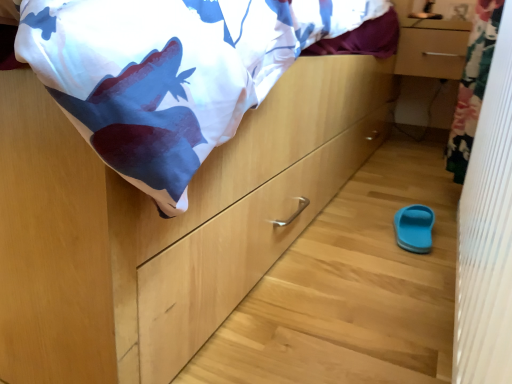
Question: Is white textured curtain at right next to matte wood drawer at upper right and touching it?

Choices:
 (A) yes
 (B) no

Answer: (B)

Question: Can you confirm if white textured curtain at right is wider than matte wood drawer at upper right?

Choices:
 (A) no
 (B) yes

Answer: (A)

Question: From the image's perspective, is white textured curtain at right below matte wood drawer at upper right?

Choices:
 (A) yes
 (B) no

Answer: (A)

Question: Is white textured curtain at right closer to camera compared to matte wood drawer at upper right?

Choices:
 (A) yes
 (B) no

Answer: (A)

Question: Is matte wood drawer at upper right surrounded by white textured curtain at right?

Choices:
 (A) yes
 (B) no

Answer: (B)

Question: Is white textured curtain at right not inside matte wood drawer at upper right?

Choices:
 (A) no
 (B) yes

Answer: (B)

Question: From a real-world perspective, is matte wood drawer at upper right positioned over white textured curtain at right based on gravity?

Choices:
 (A) yes
 (B) no

Answer: (A)

Question: Can you confirm if matte wood drawer at upper right is positioned to the left of white textured curtain at right?

Choices:
 (A) no
 (B) yes

Answer: (A)

Question: Does matte wood drawer at upper right have a greater width compared to white textured curtain at right?

Choices:
 (A) no
 (B) yes

Answer: (B)

Question: Is matte wood drawer at upper right smaller than white textured curtain at right?

Choices:
 (A) yes
 (B) no

Answer: (A)

Question: From the image's perspective, would you say matte wood drawer at upper right is shown under white textured curtain at right?

Choices:
 (A) no
 (B) yes

Answer: (A)

Question: Is matte wood drawer at upper right shorter than white textured curtain at right?

Choices:
 (A) no
 (B) yes

Answer: (B)

Question: Is there a large distance between white textured curtain at right and blue rubber slipper at lower right?

Choices:
 (A) no
 (B) yes

Answer: (A)